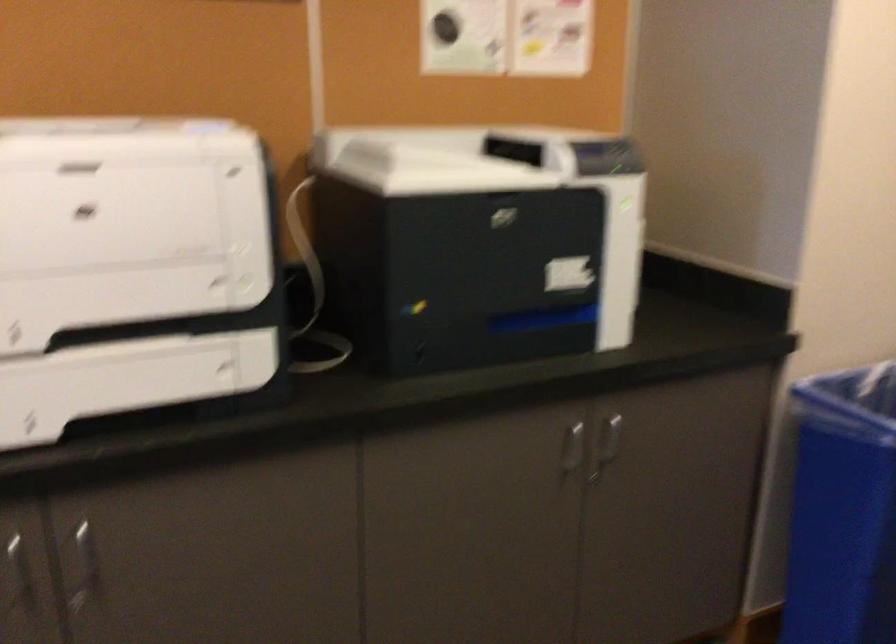
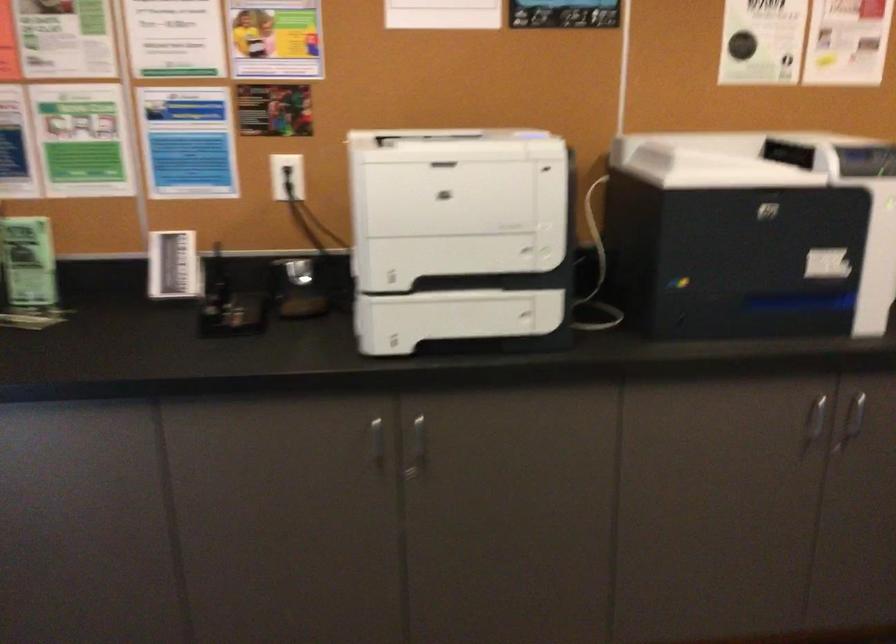
Where in the second image is the point corresponding to (x=89, y=564) from the first image?

(417, 448)